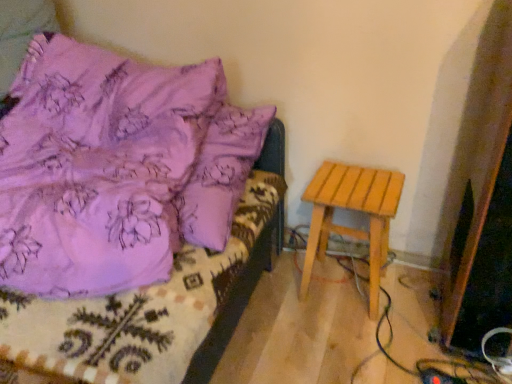
Question: Is light brown wooden stool at right in contact with purple fabric bed at upper left?

Choices:
 (A) no
 (B) yes

Answer: (A)

Question: Could you tell me if light brown wooden stool at right is turned towards purple fabric bed at upper left?

Choices:
 (A) no
 (B) yes

Answer: (A)

Question: Can you confirm if light brown wooden stool at right is thinner than purple fabric bed at upper left?

Choices:
 (A) no
 (B) yes

Answer: (B)

Question: Is light brown wooden stool at right further to camera compared to purple fabric bed at upper left?

Choices:
 (A) yes
 (B) no

Answer: (A)

Question: Can you confirm if light brown wooden stool at right is taller than purple fabric bed at upper left?

Choices:
 (A) no
 (B) yes

Answer: (A)

Question: Is light brown wooden stool at right far away from purple fabric bed at upper left?

Choices:
 (A) yes
 (B) no

Answer: (B)

Question: Considering the relative sizes of purple fabric bed at upper left and light brown wooden stool at right in the image provided, is purple fabric bed at upper left thinner than light brown wooden stool at right?

Choices:
 (A) yes
 (B) no

Answer: (B)

Question: Is purple fabric bed at upper left in contact with light brown wooden stool at right?

Choices:
 (A) yes
 (B) no

Answer: (B)

Question: Does purple fabric bed at upper left have a lesser height compared to light brown wooden stool at right?

Choices:
 (A) no
 (B) yes

Answer: (A)

Question: Can you confirm if purple fabric bed at upper left is positioned to the right of light brown wooden stool at right?

Choices:
 (A) no
 (B) yes

Answer: (A)

Question: From a real-world perspective, is purple fabric bed at upper left on top of light brown wooden stool at right?

Choices:
 (A) yes
 (B) no

Answer: (A)

Question: Is purple fabric bed at upper left wider than light brown wooden stool at right?

Choices:
 (A) no
 (B) yes

Answer: (B)

Question: In terms of size, does purple fabric bed at upper left appear bigger or smaller than light brown wooden stool at right?

Choices:
 (A) small
 (B) big

Answer: (B)